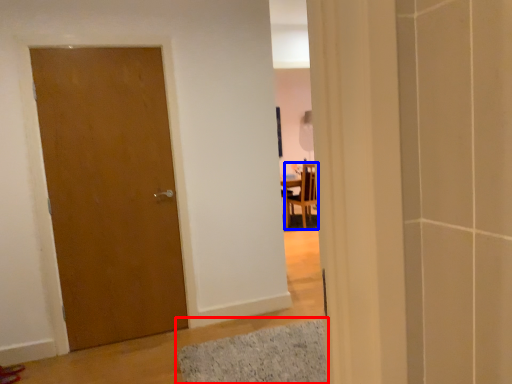
Question: Which of the following is the farthest to the observer, bath mat (highlighted by a red box) or chair (highlighted by a blue box)?

Choices:
 (A) bath mat
 (B) chair

Answer: (B)